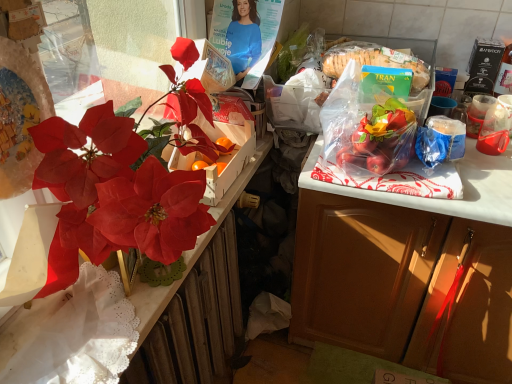
Describe the element at coordinates (196, 322) in the screenshot. I see `metallic radiator at left` at that location.

Measure the distance between matte brown cabinet at right and camera.

1.02 meters.

Measure the distance between point (220, 208) and camera.

Point (220, 208) and camera are 1.07 meters apart.

I want to click on matte plastic flowers at left, so click(229, 199).

The image size is (512, 384). In order to click on transparent plastic coffee cup at upper right, which appears as the first coffee cup when viewed from the left in this screenshot , I will do `click(477, 114)`.

Identify the location of matte red flower at left. This screenshot has height=384, width=512. (123, 183).

Is point (58, 295) farther from viewer compared to point (217, 348)?

No, it is not.

From the picture: Is metallic radiator at left a part of white lace wrapping paper at left?

No, white lace wrapping paper at left does not contain metallic radiator at left.

Looking at this image, is white lace wrapping paper at left wider than metallic radiator at left?

Correct, the width of white lace wrapping paper at left exceeds that of metallic radiator at left.

Is white lace wrapping paper at left shorter than metallic radiator at left?

Correct, white lace wrapping paper at left is not as tall as metallic radiator at left.

You are a GUI agent. You are given a task and a screenshot of the screen. Output one action in this format:
    pyautogui.click(x=<x>, y=<y>)
    Task: Click on the wrapping paper that appears below the transparent plastic cup at right, the second coffee cup from the left (from the image's perspective)
    The width and height of the screenshot is (512, 384).
    Given the screenshot: What is the action you would take?
    coord(73,334)

From the image's perspective, is white lace wrapping paper at left under transparent plastic cup at right, the second coffee cup from the left?

Indeed, from the image's perspective, white lace wrapping paper at left is shown beneath transparent plastic cup at right, the second coffee cup from the left.

Is white lace wrapping paper at left looking in the opposite direction of transparent plastic cup at right, the 1th coffee cup viewed from the right?

That's not correct — white lace wrapping paper at left is not looking away from transparent plastic cup at right, the 1th coffee cup viewed from the right.

How many degrees apart are the facing directions of white lace wrapping paper at left and transparent plastic cup at right, the 1th coffee cup viewed from the right?

They differ by 69.8 degrees in their facing directions.

Who is bigger, matte red flower at left or transparent plastic coffee cup at upper right, which is the second coffee cup in right-to-left order?

With larger size is matte red flower at left.

Between matte red flower at left and transparent plastic coffee cup at upper right, which appears as the first coffee cup when viewed from the left, which one appears on the left side from the viewer's perspective?

Positioned to the left is matte red flower at left.

How different are the orientations of matte red flower at left and transparent plastic coffee cup at upper right, which appears as the first coffee cup when viewed from the left, in degrees?

67.6 degrees separate the facing orientations of matte red flower at left and transparent plastic coffee cup at upper right, which appears as the first coffee cup when viewed from the left.

Are transparent plastic coffee cup at upper right, which appears as the first coffee cup when viewed from the left, and metallic radiator at left far apart?

transparent plastic coffee cup at upper right, which appears as the first coffee cup when viewed from the left, is actually quite close to metallic radiator at left.

Consider the image. From their relative heights in the image, would you say transparent plastic coffee cup at upper right, which is the second coffee cup in right-to-left order, is taller or shorter than metallic radiator at left?

Clearly, transparent plastic coffee cup at upper right, which is the second coffee cup in right-to-left order, is shorter compared to metallic radiator at left.

Is transparent plastic coffee cup at upper right, which is the second coffee cup in right-to-left order, looking in the opposite direction of metallic radiator at left?

That's not correct — transparent plastic coffee cup at upper right, which is the second coffee cup in right-to-left order, is not looking away from metallic radiator at left.

Is transparent plastic coffee cup at upper right, which is the second coffee cup in right-to-left order, located outside metallic radiator at left?

Absolutely, transparent plastic coffee cup at upper right, which is the second coffee cup in right-to-left order, is external to metallic radiator at left.

Can you confirm if matte plastic flowers at left is positioned to the right of white lace wrapping paper at left?

Yes, matte plastic flowers at left is to the right of white lace wrapping paper at left.

Is the position of matte plastic flowers at left less distant than that of white lace wrapping paper at left?

No, matte plastic flowers at left is further to the viewer.

Looking at this image, which is nearer, (140, 318) or (98, 304)?

The point (140, 318) is closer.

Considering the relative sizes of matte plastic flowers at left and white lace wrapping paper at left in the image provided, is matte plastic flowers at left wider than white lace wrapping paper at left?

In fact, matte plastic flowers at left might be narrower than white lace wrapping paper at left.

From the image's perspective, which one is positioned lower, matte red flower at left or matte plastic flowers at left?

matte plastic flowers at left, from the image's perspective.

Is matte red flower at left directly adjacent to matte plastic flowers at left?

No, matte red flower at left is not in contact with matte plastic flowers at left.

This screenshot has width=512, height=384. Identify the location of desk below the matte red flower at left (from a real-world perspective). (229, 199).

Considering the positions of point (126, 194) and point (5, 359), is point (126, 194) closer or farther from the camera than point (5, 359)?

Point (126, 194) is closer to the camera than point (5, 359).

Does transparent plastic cup at right, the 1th coffee cup viewed from the right, come in front of matte plastic flowers at left?

No, it is not.

Is transparent plastic cup at right, the second coffee cup from the left, shorter than matte plastic flowers at left?

No.

Where is `the 1st coffee cup above the matte plastic flowers at left (from a real-world perspective)`? This screenshot has height=384, width=512. the 1st coffee cup above the matte plastic flowers at left (from a real-world perspective) is located at coordinates (496, 127).

How distant is transparent plastic cup at right, the second coffee cup from the left, from matte plastic flowers at left?

transparent plastic cup at right, the second coffee cup from the left, and matte plastic flowers at left are 28.23 inches apart from each other.

In the image, there is a white lace wrapping paper at left. Where is `radiator below it (from the image's perspective)`? radiator below it (from the image's perspective) is located at coordinates (196, 322).

Starting from the white lace wrapping paper at left, which coffee cup is the 2nd one to the right? Please provide its 2D coordinates.

[(496, 127)]

Estimate the real-world distances between objects in this image. Which object is further from transparent plastic coffee cup at upper right, which appears as the first coffee cup when viewed from the left, matte brown cabinet at right or matte plastic flowers at left?

The object further to transparent plastic coffee cup at upper right, which appears as the first coffee cup when viewed from the left, is matte plastic flowers at left.

Estimate the real-world distances between objects in this image. Which object is further from metallic radiator at left, white lace wrapping paper at left or matte brown cabinet at right?

matte brown cabinet at right lies further to metallic radiator at left than the other object.

Estimate the real-world distances between objects in this image. Which object is closer to metallic radiator at left, matte brown cabinet at right or transparent plastic cup at right, the 1th coffee cup viewed from the right?

matte brown cabinet at right.

Considering their positions, is matte plastic flowers at left positioned further to transparent plastic coffee cup at upper right, which appears as the first coffee cup when viewed from the left, than transparent plastic cup at right, the 1th coffee cup viewed from the right?

matte plastic flowers at left is further to transparent plastic coffee cup at upper right, which appears as the first coffee cup when viewed from the left.

Considering their positions, is matte brown cabinet at right positioned further to metallic radiator at left than white lace wrapping paper at left?

matte brown cabinet at right is further to metallic radiator at left.

Which object lies nearer to the anchor point metallic radiator at left, matte plastic flowers at left or matte brown cabinet at right?

matte plastic flowers at left is closer to metallic radiator at left.

Considering their positions, is matte plastic flowers at left positioned closer to transparent plastic coffee cup at upper right, which appears as the first coffee cup when viewed from the left, than matte red flower at left?

matte plastic flowers at left.

When comparing their distances from transparent plastic coffee cup at upper right, which is the second coffee cup in right-to-left order, does matte brown cabinet at right or transparent plastic cup at right, the 1th coffee cup viewed from the right, seem further?

The object further to transparent plastic coffee cup at upper right, which is the second coffee cup in right-to-left order, is matte brown cabinet at right.

Locate an element on the screen. wrapping paper between matte red flower at left and metallic radiator at left in the vertical direction is located at coordinates (73, 334).

Where is `radiator between matte red flower at left and matte brown cabinet at right`? This screenshot has width=512, height=384. radiator between matte red flower at left and matte brown cabinet at right is located at coordinates (196, 322).

Where is `radiator between white lace wrapping paper at left and matte brown cabinet at right in the horizontal direction`? This screenshot has width=512, height=384. radiator between white lace wrapping paper at left and matte brown cabinet at right in the horizontal direction is located at coordinates (196, 322).

Locate an element on the screen. This screenshot has height=384, width=512. cabinetry between white lace wrapping paper at left and transparent plastic coffee cup at upper right, which appears as the first coffee cup when viewed from the left, in the horizontal direction is located at coordinates (402, 285).